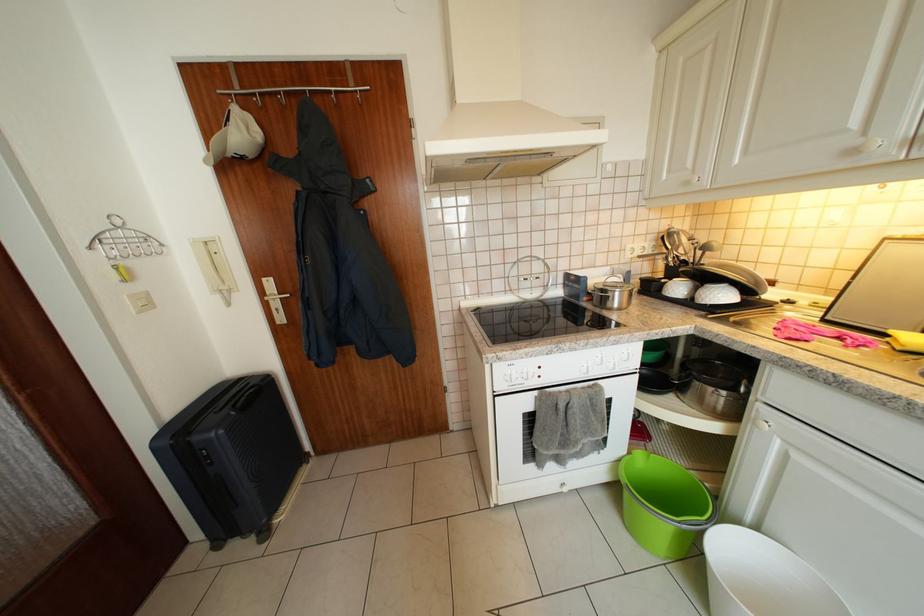
Find where to lift the intercom handset. Please return your answer as a coordinate pair (x, y).

(211, 265)